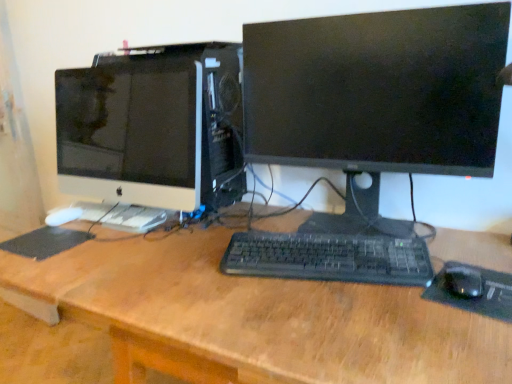
The image size is (512, 384). I want to click on vacant region under black matte mousepad at lower left, the 1th mousepad from the back (from a real-world perspective), so click(x=45, y=240).